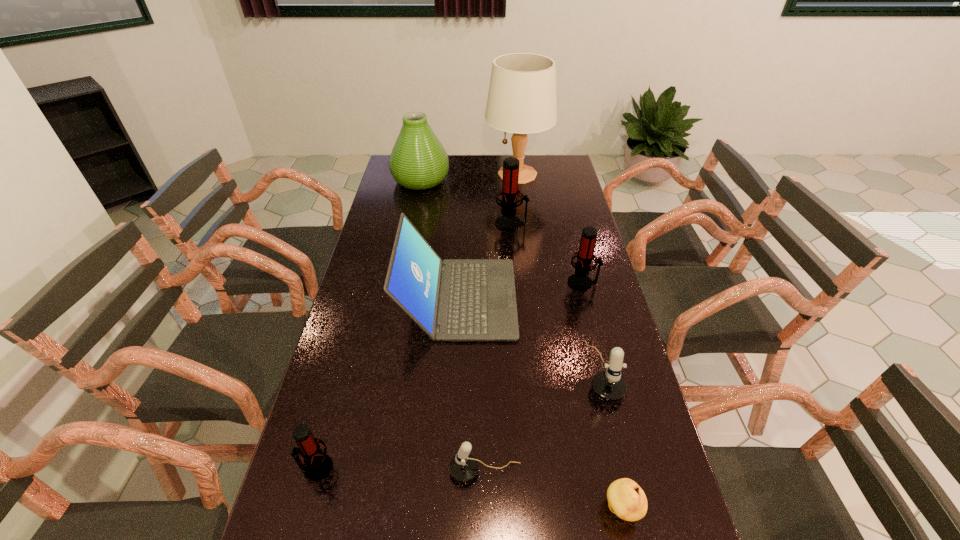
You are a GUI agent. You are given a task and a screenshot of the screen. Output one action in this format:
    pyautogui.click(x=<x>, y=<y>)
    Task: Click on the free spot that satisfies the following two spatial constraints: 1. on the back side of the tallest microphone; 2. on the left side of the shortest microphone
    The width and height of the screenshot is (960, 540).
    Given the screenshot: What is the action you would take?
    pyautogui.click(x=483, y=224)

Identify the location of free point that satisfies the following two spatial constraints: 1. on the back side of the biggest red microphone; 2. on the right side of the beige table lamp. The height and width of the screenshot is (540, 960). (507, 174).